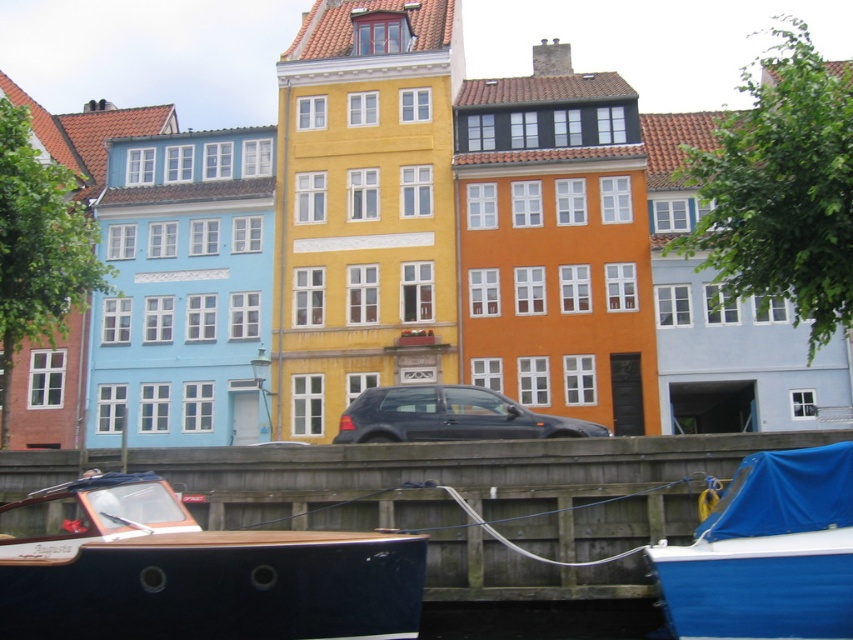
You are a tour guide explaining the scene to visitors. Point out the two objects in the image and ask whether the wooden dock at lower center can accommodate the satin black car at center based on their sizes.

The wooden dock at lower center is larger in size than the satin black car at center, so it can accommodate the car.

You are a tourist standing on the wooden dock and want to take a photo of the blue fabric boat at lower right and the satin black car at center. Which object should you point your camera towards first if you want to capture both in a single frame without moving your position?

You should point your camera towards the blue fabric boat at lower right first because it is located below the satin black car at center, so adjusting the angle to include both would require framing from the lower area upwards.

In the scene shown: You are standing on the wooden dock at lower center and want to reach the satin black car at center. Which direction should you move to get closer to the car?

Since the wooden dock at lower center is closer to the viewer than the satin black car at center, you should move forward away from the dock towards the car to get closer to the satin black car at center.